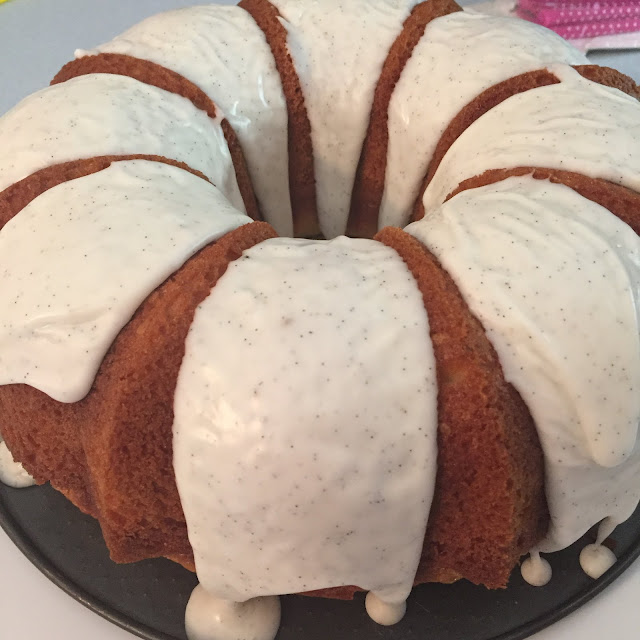
This screenshot has height=640, width=640. In order to click on countertop in this screenshot , I will do `click(25, 603)`.